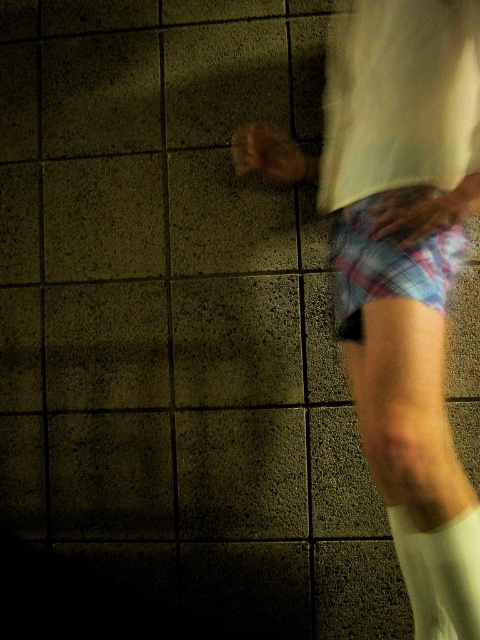
You are a photographer adjusting your camera settings. You notice the plaid shorts at right and the white soft sock at lower right in your frame. Which object should you focus on to ensure the closer one is sharp?

You should focus on the plaid shorts at right because it is closer to the viewer than the white soft sock at lower right.